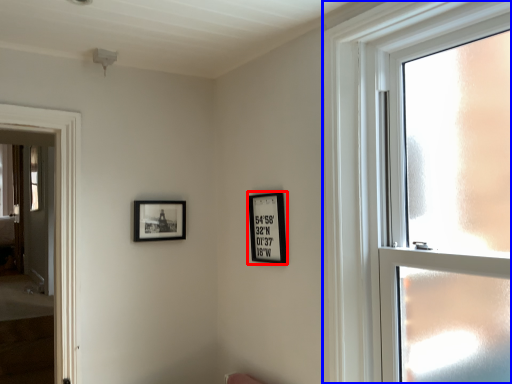
Question: Among these objects, which one is farthest to the camera, picture frame (highlighted by a red box) or window (highlighted by a blue box)?

Choices:
 (A) picture frame
 (B) window

Answer: (A)